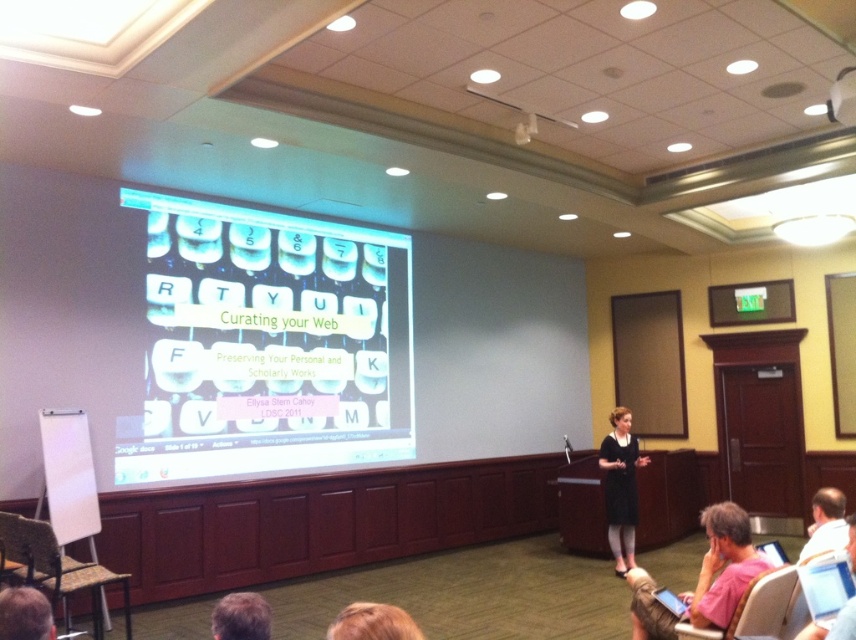
Question: Is translucent plastic keyboard at center positioned in front of black fabric dress at center?

Choices:
 (A) yes
 (B) no

Answer: (A)

Question: Is black fabric dress at center behind white plastic chair at lower right?

Choices:
 (A) no
 (B) yes

Answer: (B)

Question: Based on their relative distances, which object is nearer to the blonde hair at lower center?

Choices:
 (A) white plastic chair at lower right
 (B) wooden chair at lower left
 (C) black fabric dress at center
 (D) pink fabric laptop at lower right

Answer: (A)

Question: Which object appears closest to the camera in this image?

Choices:
 (A) pink fabric laptop at lower right
 (B) blonde hair at lower center

Answer: (B)

Question: In this image, where is pink fabric laptop at lower right located relative to wooden chair at lower left?

Choices:
 (A) right
 (B) left

Answer: (A)

Question: Which point appears farthest from the camera in this image?

Choices:
 (A) pos(393,630)
 (B) pos(623,426)

Answer: (B)